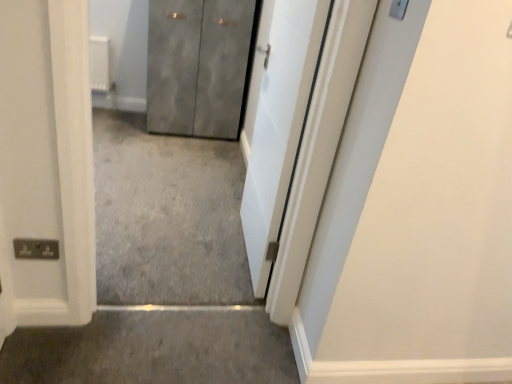
Question: Which direction should I rotate to face white smooth door at center, acting as the second door starting from the left, — up or down?

Choices:
 (A) down
 (B) up

Answer: (B)

Question: Is metallic gray cabinet at center, which ranks as the 2th door in front-to-back order, at the left side of gray carpet at lower center?

Choices:
 (A) yes
 (B) no

Answer: (A)

Question: Can you see metallic gray cabinet at center, which ranks as the 2th door in front-to-back order, touching gray carpet at lower center?

Choices:
 (A) no
 (B) yes

Answer: (A)

Question: Considering the relative sizes of metallic gray cabinet at center, the first door from the left, and gray carpet at lower center in the image provided, is metallic gray cabinet at center, the first door from the left, smaller than gray carpet at lower center?

Choices:
 (A) yes
 (B) no

Answer: (B)

Question: From a real-world perspective, is metallic gray cabinet at center, marked as the 1th door in a back-to-front arrangement, located higher than gray carpet at lower center?

Choices:
 (A) no
 (B) yes

Answer: (B)

Question: Can you confirm if metallic gray cabinet at center, which is the second door in right-to-left order, is taller than gray carpet at lower center?

Choices:
 (A) yes
 (B) no

Answer: (A)

Question: Is gray carpet at lower center a part of metallic gray cabinet at center, the first door from the left?

Choices:
 (A) yes
 (B) no

Answer: (B)

Question: Is gray carpet at lower center oriented away from white smooth door at center, the 1th door positioned from the front?

Choices:
 (A) no
 (B) yes

Answer: (A)

Question: From a real-world perspective, is gray carpet at lower center located beneath white smooth door at center, the 1th door positioned from the front?

Choices:
 (A) yes
 (B) no

Answer: (A)

Question: Is gray carpet at lower center shorter than white smooth door at center, acting as the second door starting from the left?

Choices:
 (A) yes
 (B) no

Answer: (A)

Question: Does gray carpet at lower center have a smaller size compared to white smooth door at center, marked as the first door in a right-to-left arrangement?

Choices:
 (A) yes
 (B) no

Answer: (A)

Question: Is gray carpet at lower center located outside white smooth door at center, acting as the second door starting from the left?

Choices:
 (A) yes
 (B) no

Answer: (A)

Question: Would you say gray carpet at lower center contains white smooth door at center, marked as the first door in a right-to-left arrangement?

Choices:
 (A) yes
 (B) no

Answer: (B)

Question: Is white smooth door at center, positioned as the second door in back-to-front order, shorter than gray carpet at lower center?

Choices:
 (A) no
 (B) yes

Answer: (A)